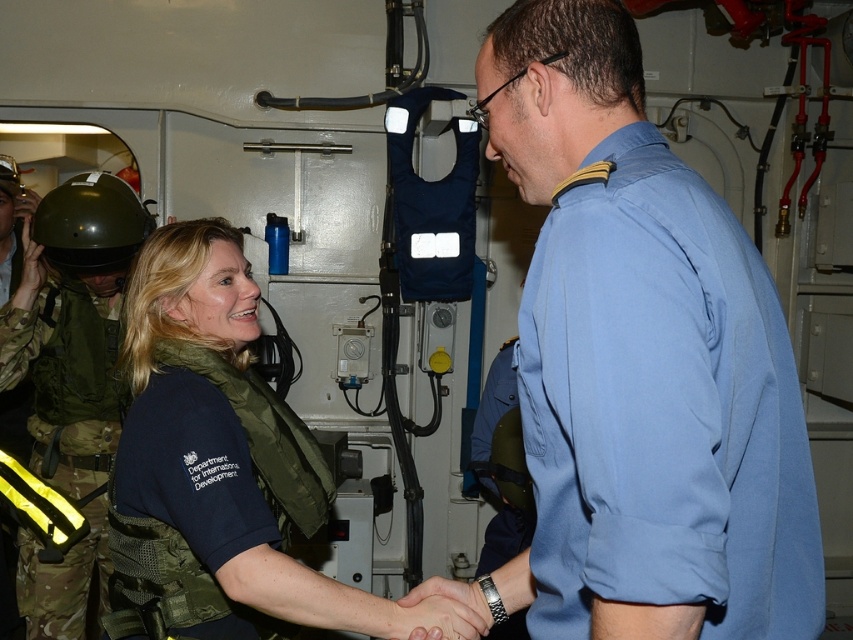
Can you confirm if green matte helmet at left is positioned above dark blue fabric vest at center?

Yes, green matte helmet at left is above dark blue fabric vest at center.

Is green matte helmet at left positioned at the back of dark blue fabric vest at center?

Yes.

Find the location of a particular element. green matte helmet at left is located at coordinates (70, 376).

Does blue cotton shirt at right come in front of dark blue fabric vest at center?

That is True.

Who is positioned more to the right, blue cotton shirt at right or dark blue fabric vest at center?

blue cotton shirt at right is more to the right.

Image resolution: width=853 pixels, height=640 pixels. Describe the element at coordinates (660, 406) in the screenshot. I see `blue cotton shirt at right` at that location.

I want to click on blue cotton shirt at right, so click(x=660, y=406).

Does blue cotton shirt at right appear on the left side of green matte helmet at left?

In fact, blue cotton shirt at right is to the right of green matte helmet at left.

Between blue cotton shirt at right and green matte helmet at left, which one is positioned higher?

blue cotton shirt at right is above.

Between point (650, 195) and point (84, 176), which one is positioned in front?

Point (650, 195) is in front.

You are a GUI agent. You are given a task and a screenshot of the screen. Output one action in this format:
    pyautogui.click(x=<x>, y=<y>)
    Task: Click on the blue cotton shirt at right
    The height and width of the screenshot is (640, 853).
    Given the screenshot: What is the action you would take?
    pyautogui.click(x=660, y=406)